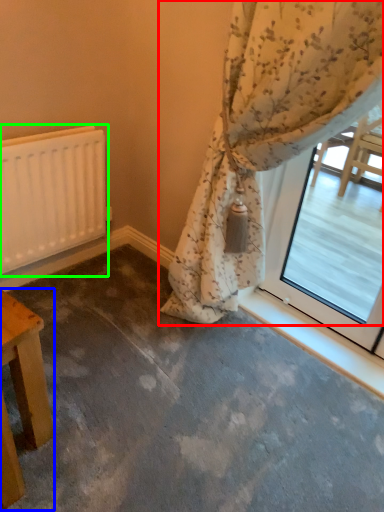
Question: Which object is the closest to the curtain (highlighted by a red box)? Choose among these: table (highlighted by a blue box) or radiator (highlighted by a green box).

Choices:
 (A) table
 (B) radiator

Answer: (B)